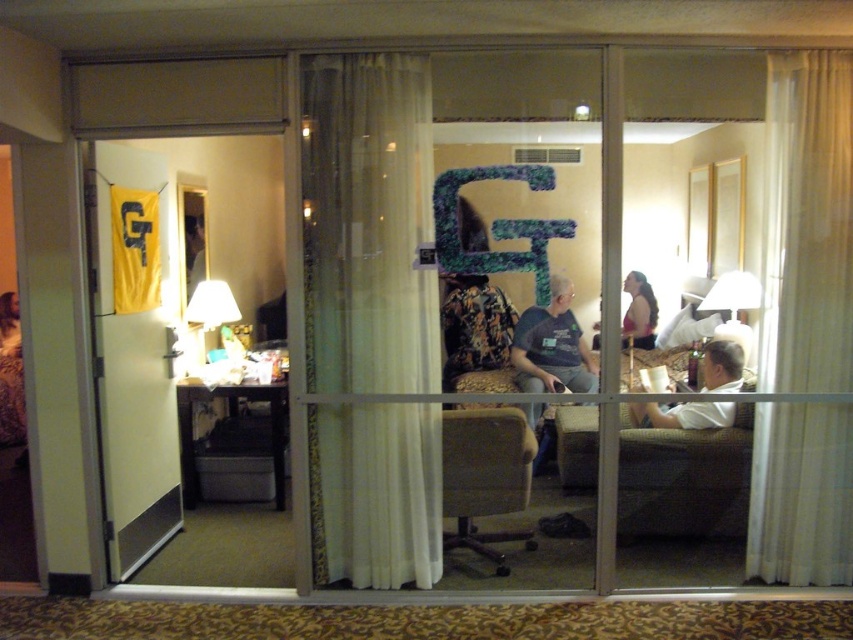
Question: Is white sheer curtain at right thinner than dark gray t-shirt at center?

Choices:
 (A) yes
 (B) no

Answer: (B)

Question: Considering the relative positions of clear glass door at left and dark brown leather armchair at center in the image provided, where is clear glass door at left located with respect to dark brown leather armchair at center?

Choices:
 (A) left
 (B) right

Answer: (A)

Question: Which object appears farthest from the camera in this image?

Choices:
 (A) white sheer curtain at right
 (B) sheer white curtain at center
 (C) dark brown leather armchair at center
 (D) white fabric shirt at right

Answer: (D)

Question: Considering the real-world distances, which object is farthest from the matte pink tank top at center?

Choices:
 (A) clear glass door at left
 (B) sheer white curtain at center

Answer: (A)

Question: Is white sheer curtain at right positioned before matte pink tank top at center?

Choices:
 (A) no
 (B) yes

Answer: (B)

Question: Estimate the real-world distances between objects in this image. Which object is closer to the white matte screen door at left?

Choices:
 (A) clear glass door at left
 (B) dark gray t-shirt at center

Answer: (A)